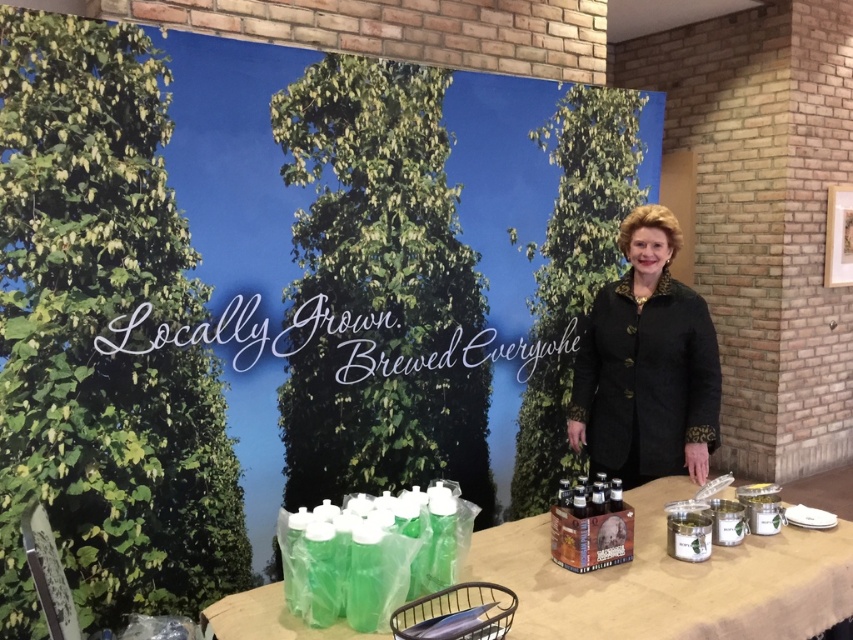
Question: Where is translucent plastic bottles at lower left located in relation to green plastic bottles at lower left in the image?

Choices:
 (A) below
 (B) above

Answer: (A)

Question: Does translucent plastic bottles at lower left have a lesser width compared to green plastic bottles at lower left?

Choices:
 (A) yes
 (B) no

Answer: (B)

Question: Among these objects, which one is nearest to the camera?

Choices:
 (A) translucent plastic bottles at lower left
 (B) black textured coat at center

Answer: (A)

Question: Which object is the closest to the translucent plastic bottles at lower left?

Choices:
 (A) black textured coat at center
 (B) green plastic bottles at lower left

Answer: (B)

Question: Which object appears farthest from the camera in this image?

Choices:
 (A) translucent plastic bottles at lower left
 (B) green plastic bottles at lower left

Answer: (B)

Question: Does black textured coat at center appear under green plastic bottles at lower left?

Choices:
 (A) no
 (B) yes

Answer: (A)